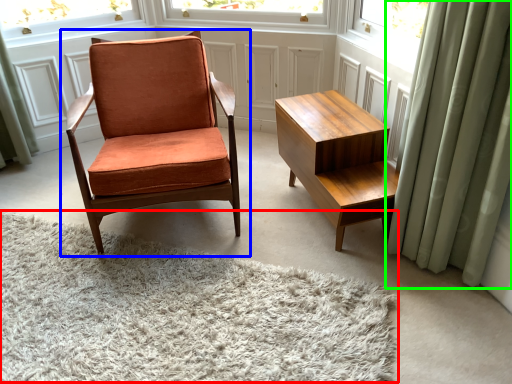
Question: Which is nearer to the plain (highlighted by a red box)? chair (highlighted by a blue box) or curtain (highlighted by a green box).

Choices:
 (A) chair
 (B) curtain

Answer: (A)